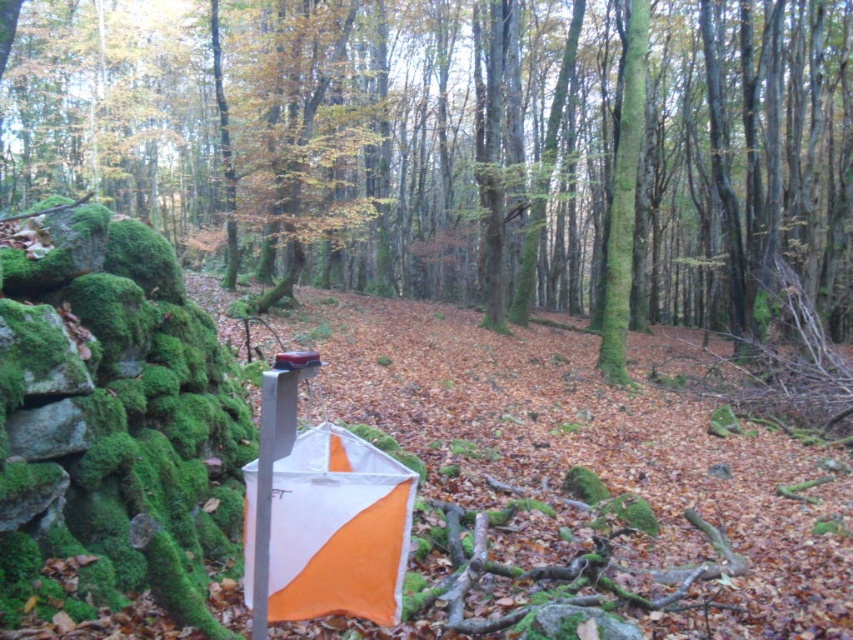
Question: Is orange fabric umbrella at center above green mossy tree at center?

Choices:
 (A) no
 (B) yes

Answer: (A)

Question: Which object appears farthest from the camera in this image?

Choices:
 (A) orange fabric umbrella at center
 (B) green mossy tree at center

Answer: (B)

Question: From the image, what is the correct spatial relationship of orange fabric umbrella at center in relation to green mossy tree at center?

Choices:
 (A) below
 (B) above

Answer: (A)

Question: Which of the following is the closest to the observer?

Choices:
 (A) (321, 540)
 (B) (608, 260)

Answer: (A)

Question: Among these points, which one is nearest to the camera?

Choices:
 (A) (602, 316)
 (B) (332, 612)

Answer: (B)

Question: Does orange fabric umbrella at center appear on the right side of green mossy tree at center?

Choices:
 (A) no
 (B) yes

Answer: (A)